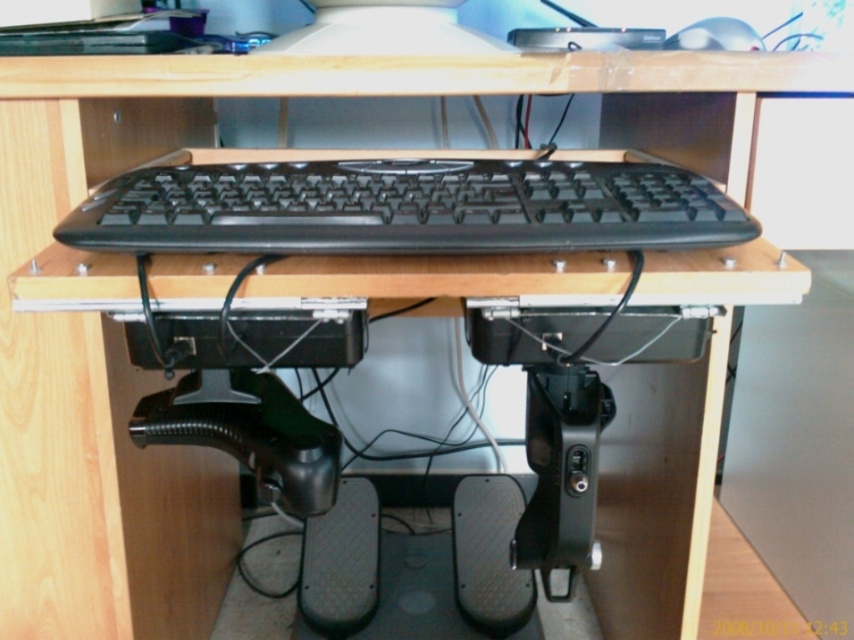
You are setting up your desk and need to place a new wireless charger between the matte black monitor at upper center and the silver metallic mouse at upper right. Based on their positions, where should you place the wireless charger?

The wireless charger should be placed to the right of the matte black monitor at upper center and to the left of the silver metallic mouse at upper right since the matte black monitor at upper center is positioned to the left of the silver metallic mouse at upper right.

You are setting up a desk and need to ensure there is enough space between the black matte keyboard at center and the matte black monitor at upper center for a cable to pass through. The cable requires at least 6 inches of clearance. Based on the image, is there sufficient space?

The black matte keyboard at center is 6.25 inches from the matte black monitor at upper center, which is just enough clearance for the cable since it meets the minimum requirement of 6 inches.

You are setting up a desk organizer that requires knowing the width of objects. You have a black matte keyboard at center and a matte black monitor at upper center. Which object should you measure first if the organizer can only accommodate items wider than 40 cm?

The black matte keyboard at center might be wider than matte black monitor at upper center. Therefore, you should measure the black matte keyboard at center first to confirm its width before placing it in the organizer.